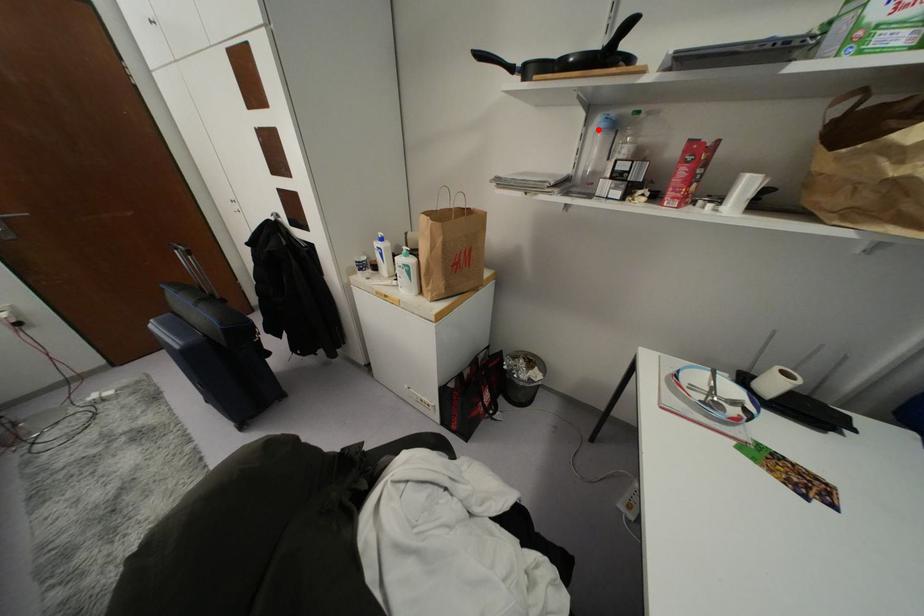
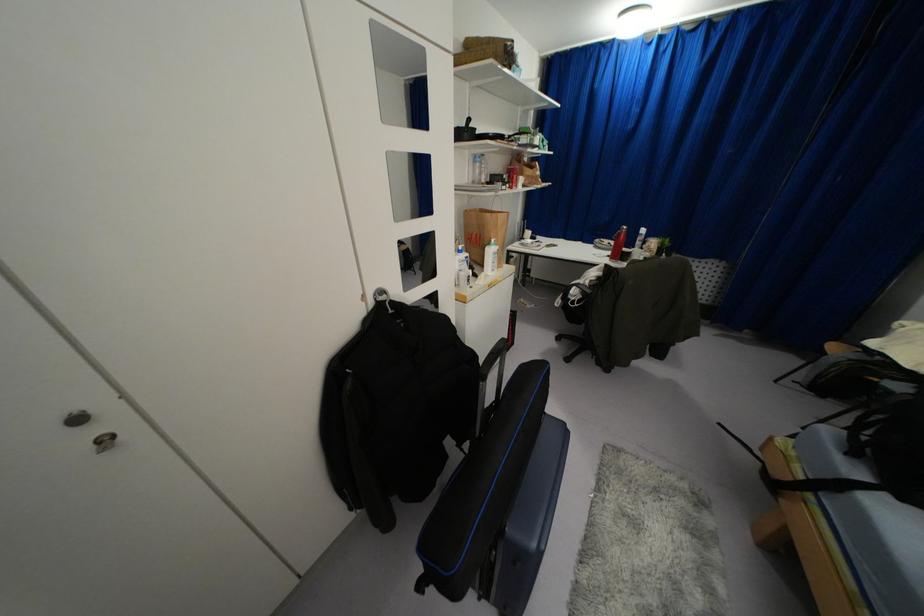
Question: I am providing you with two images of the same scene from different viewpoints. Given a red point in image1, look at the same physical point in image2. Is it:

Choices:
 (A) Closer to the viewpoint
 (B) Farther from the viewpoint

Answer: (A)